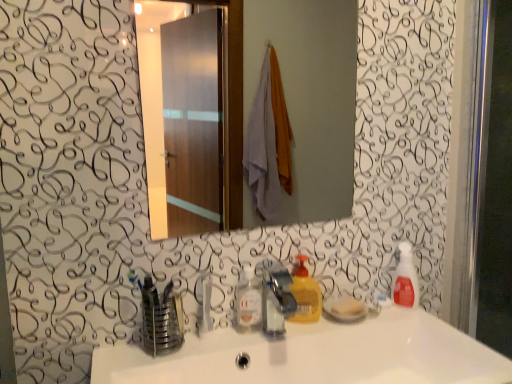
The width and height of the screenshot is (512, 384). I want to click on free space in front of translucent plastic soap dispenser at right, so click(x=428, y=322).